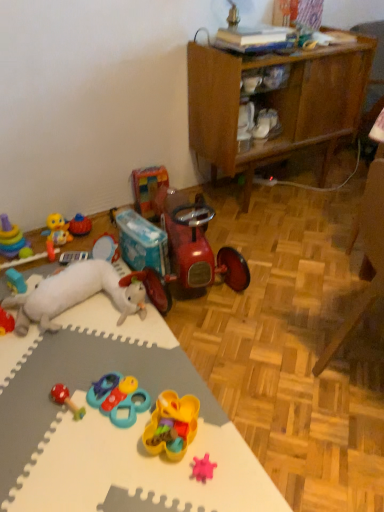
This screenshot has width=384, height=512. What are the coordinates of `free space behind pink rubber star at lower center, placed as the twelfth toy when sorted from left to right` in the screenshot? It's located at (204, 425).